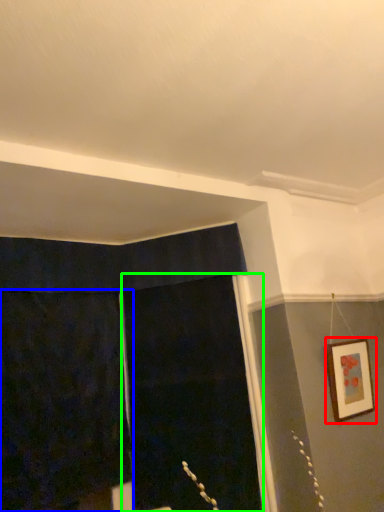
Question: Considering the real-world distances, which object is farthest from picture frame (highlighted by a red box)? curtain (highlighted by a blue box) or screen door (highlighted by a green box)?

Choices:
 (A) curtain
 (B) screen door

Answer: (A)